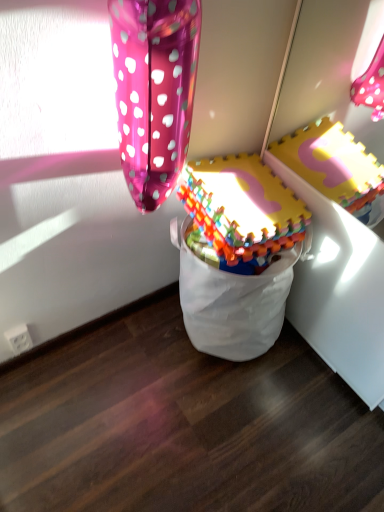
Question: Should I look upward or downward to see multicolored plastic blocks at center?

Choices:
 (A) up
 (B) down

Answer: (A)

Question: Are glossy metallic balloon at upper left and multicolored plastic blocks at center beside each other?

Choices:
 (A) yes
 (B) no

Answer: (B)

Question: Does glossy metallic balloon at upper left have a lesser height compared to multicolored plastic blocks at center?

Choices:
 (A) yes
 (B) no

Answer: (B)

Question: From the image's perspective, is glossy metallic balloon at upper left over multicolored plastic blocks at center?

Choices:
 (A) no
 (B) yes

Answer: (B)

Question: Are glossy metallic balloon at upper left and multicolored plastic blocks at center located far from each other?

Choices:
 (A) yes
 (B) no

Answer: (B)

Question: Does glossy metallic balloon at upper left appear on the right side of multicolored plastic blocks at center?

Choices:
 (A) yes
 (B) no

Answer: (B)

Question: Is glossy metallic balloon at upper left aimed at multicolored plastic blocks at center?

Choices:
 (A) yes
 (B) no

Answer: (B)

Question: Considering the relative positions of multicolored plastic blocks at center and glossy metallic balloon at upper left in the image provided, is multicolored plastic blocks at center in front of glossy metallic balloon at upper left?

Choices:
 (A) no
 (B) yes

Answer: (A)

Question: Is multicolored plastic blocks at center surrounding glossy metallic balloon at upper left?

Choices:
 (A) no
 (B) yes

Answer: (A)

Question: From a real-world perspective, is multicolored plastic blocks at center under glossy metallic balloon at upper left?

Choices:
 (A) no
 (B) yes

Answer: (B)

Question: Can you confirm if multicolored plastic blocks at center is wider than glossy metallic balloon at upper left?

Choices:
 (A) yes
 (B) no

Answer: (A)

Question: Is multicolored plastic blocks at center smaller than glossy metallic balloon at upper left?

Choices:
 (A) yes
 (B) no

Answer: (B)

Question: Is multicolored plastic blocks at center at the right side of glossy metallic balloon at upper left?

Choices:
 (A) no
 (B) yes

Answer: (B)

Question: Is multicolored plastic blocks at center in front of or behind glossy metallic balloon at upper left in the image?

Choices:
 (A) behind
 (B) front

Answer: (A)